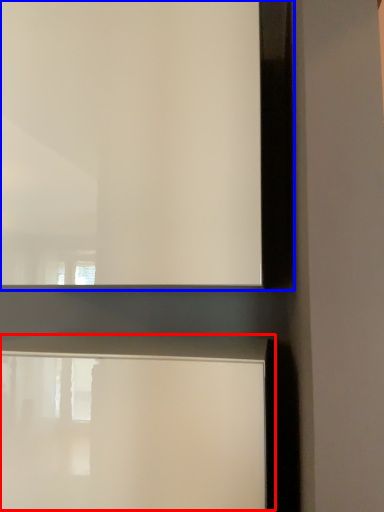
Question: Among these objects, which one is nearest to the camera, table (highlighted by a red box) or window frame (highlighted by a blue box)?

Choices:
 (A) table
 (B) window frame

Answer: (A)